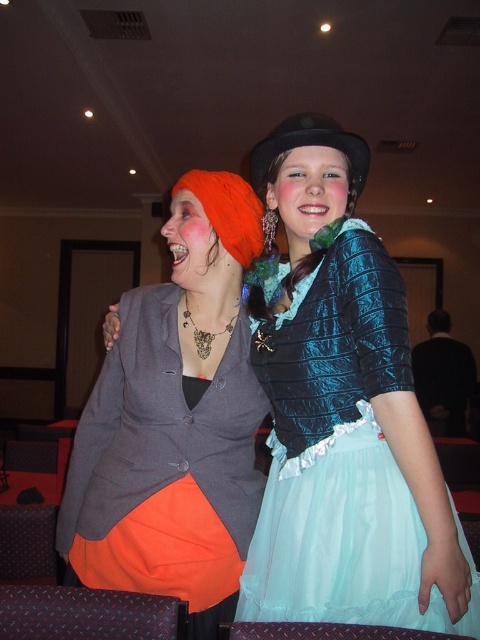
Question: Estimate the real-world distances between objects in this image. Which object is farther from the orange matte skirt at center?

Choices:
 (A) black felt hat at upper center
 (B) teal satin dress at center

Answer: (A)

Question: Considering the relative positions of orange matte skirt at center and teal satin dress at center in the image provided, where is orange matte skirt at center located with respect to teal satin dress at center?

Choices:
 (A) above
 (B) below

Answer: (A)

Question: Among these points, which one is nearest to the camera?

Choices:
 (A) (283, 124)
 (B) (274, 490)

Answer: (A)

Question: Is orange matte skirt at center above teal satin dress at center?

Choices:
 (A) yes
 (B) no

Answer: (A)

Question: Estimate the real-world distances between objects in this image. Which object is farther from the black felt hat at upper center?

Choices:
 (A) orange matte skirt at center
 (B) teal satin dress at center

Answer: (B)

Question: Is orange matte skirt at center to the right of teal satin dress at center from the viewer's perspective?

Choices:
 (A) no
 (B) yes

Answer: (A)